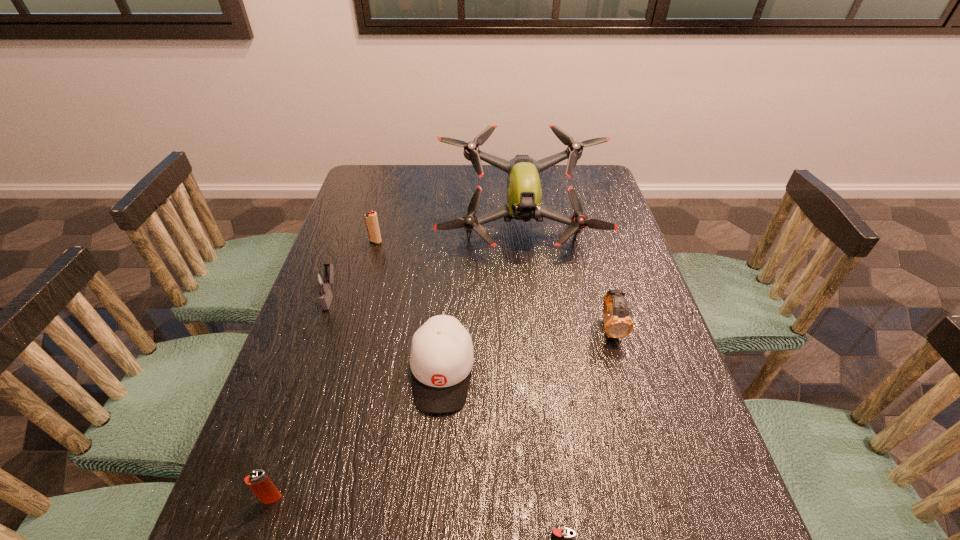
This screenshot has width=960, height=540. I want to click on vacant area in the image that satisfies the following two spatial constraints: 1. on the front side of the second farthest igniter; 2. on the right side of the sixth farthest object, so click(260, 498).